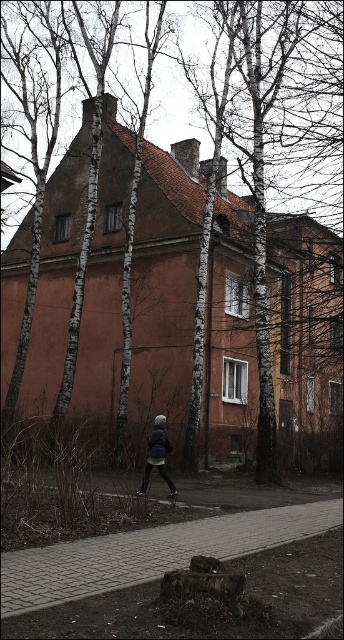
Is white bark tree at center behind paved brick sidewalk at center?

Yes, it is.

Does white bark tree at center have a greater height compared to paved brick sidewalk at center?

Yes, white bark tree at center is taller than paved brick sidewalk at center.

Does point (295, 106) come closer to viewer compared to point (233, 548)?

No, (295, 106) is behind (233, 548).

This screenshot has width=344, height=640. I want to click on white bark tree at center, so click(276, 244).

Does white bark tree at center have a greater height compared to dark blue fabric jacket at center?

Yes, white bark tree at center is taller than dark blue fabric jacket at center.

Which of these two, white bark tree at center or dark blue fabric jacket at center, stands taller?

white bark tree at center is taller.

Between point (252, 392) and point (152, 442), which one is positioned in front?

Positioned in front is point (152, 442).

Identify the location of white bark tree at center. This screenshot has height=640, width=344. (276, 244).

Does paved brick sidewalk at center have a larger size compared to dark blue fabric jacket at center?

Yes.

Looking at this image, who is positioned more to the left, paved brick sidewalk at center or dark blue fabric jacket at center?

dark blue fabric jacket at center

Measure the distance between paved brick sidewalk at center and camera.

A distance of 4.82 meters exists between paved brick sidewalk at center and camera.

Where is `paved brick sidewalk at center`? The width and height of the screenshot is (344, 640). paved brick sidewalk at center is located at coordinates (149, 554).